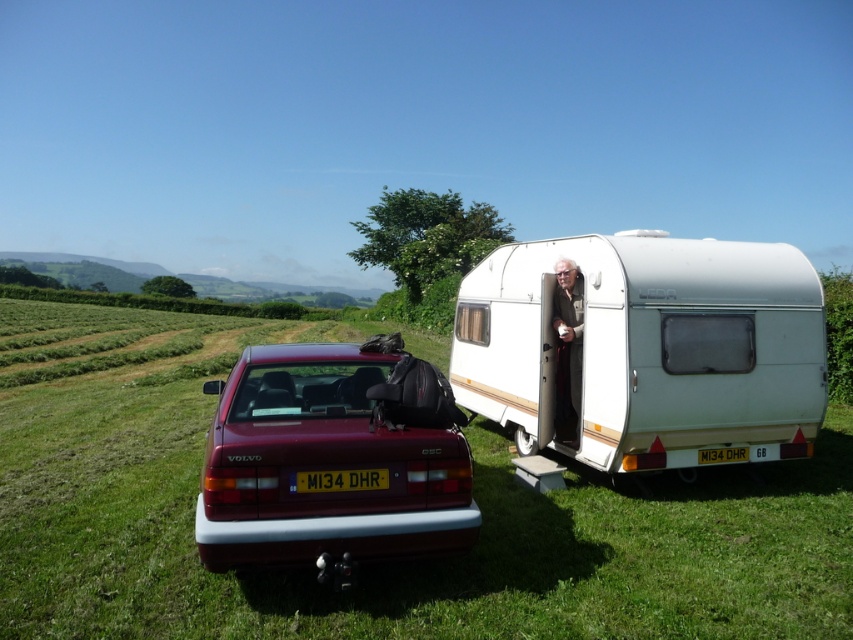
You are planning to set up a picnic area in the green grassy field at center and the white plastic caravan at right. Which location has more space for your picnic setup?

The green grassy field at center has more space for the picnic setup because it is bigger than the white plastic caravan at right.

You are a delivery drone trying to fly through the space between the shiny maroon car at center and the black plastic license plate at center. Can you pass through this space if your drone is 0.5 meters tall?

The shiny maroon car at center is much taller than the black plastic license plate at center, so the space between them is sufficient for the drone to pass through as long as it stays below the car and above the license plate.